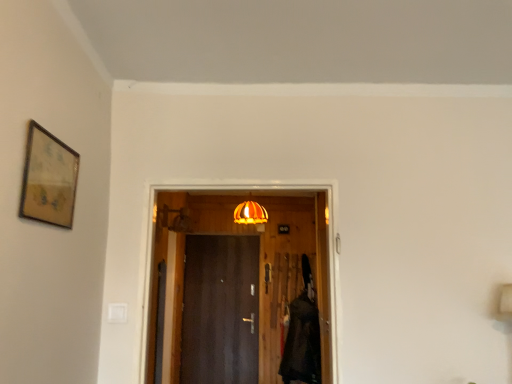
Where is `vacant point above dark wood door at center, the first door from the bottom (from a real-world perspective)`? The width and height of the screenshot is (512, 384). vacant point above dark wood door at center, the first door from the bottom (from a real-world perspective) is located at coordinates (224, 237).